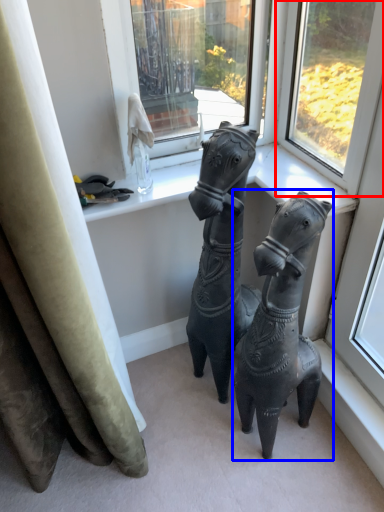
Question: Which object appears closest to the camera in this image, window (highlighted by a red box) or horse (highlighted by a blue box)?

Choices:
 (A) window
 (B) horse

Answer: (B)